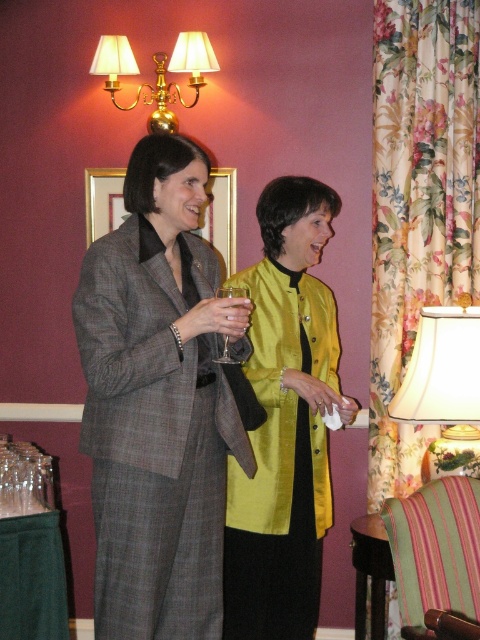
Is silky yellow blouse at center positioned behind clear glass wine glass at center?

Yes, it is behind clear glass wine glass at center.

Measure the distance between point (326, 193) and camera.

Point (326, 193) and camera are 2.77 meters apart from each other.

What are the coordinates of `silky yellow blouse at center` in the screenshot? It's located at (285, 420).

Is gold brass wall sconce at upper left taller than clear glass wine glass at center?

Correct, gold brass wall sconce at upper left is much taller as clear glass wine glass at center.

Does gold brass wall sconce at upper left appear over clear glass wine glass at center?

Correct, gold brass wall sconce at upper left is located above clear glass wine glass at center.

Locate an element on the screen. The image size is (480, 640). gold brass wall sconce at upper left is located at coordinates (156, 72).

Measure the distance between point (137, 340) and camera.

The distance of point (137, 340) from camera is 2.30 meters.

Does plaid wool suit at center have a greater width compared to gold brass wall sconce at upper left?

Correct, the width of plaid wool suit at center exceeds that of gold brass wall sconce at upper left.

The height and width of the screenshot is (640, 480). In order to click on plaid wool suit at center in this screenshot , I will do `click(159, 403)`.